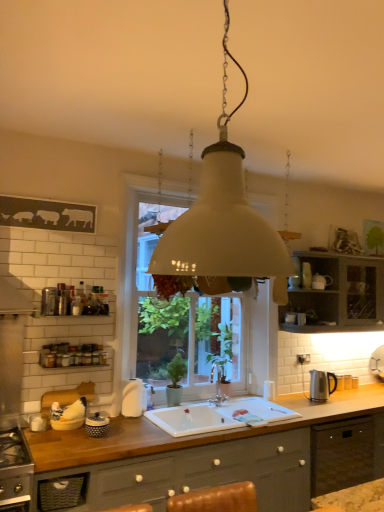
This screenshot has height=512, width=384. In order to click on free space in front of polka dot ceramic jar at lower left, the first appliance in the front-to-back sequence in this screenshot , I will do `click(100, 444)`.